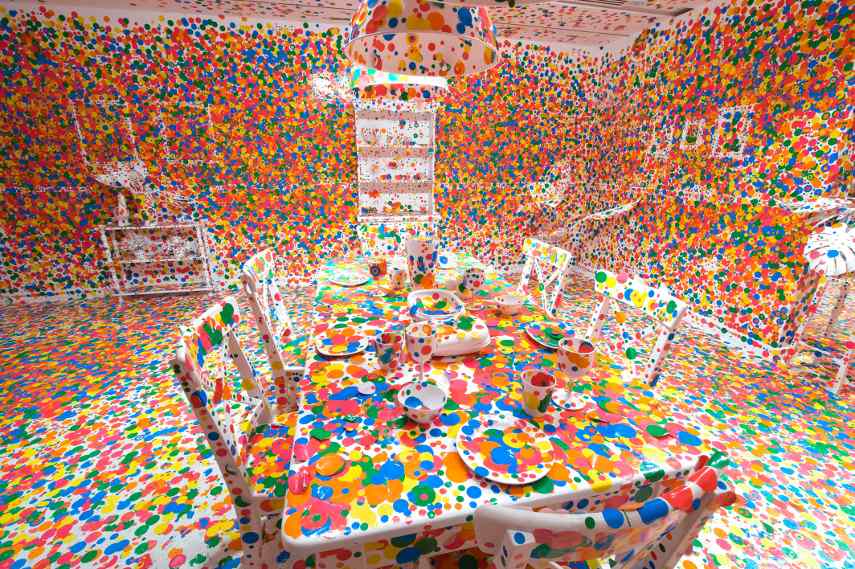
Where is `chair`? chair is located at coordinates (225, 461).